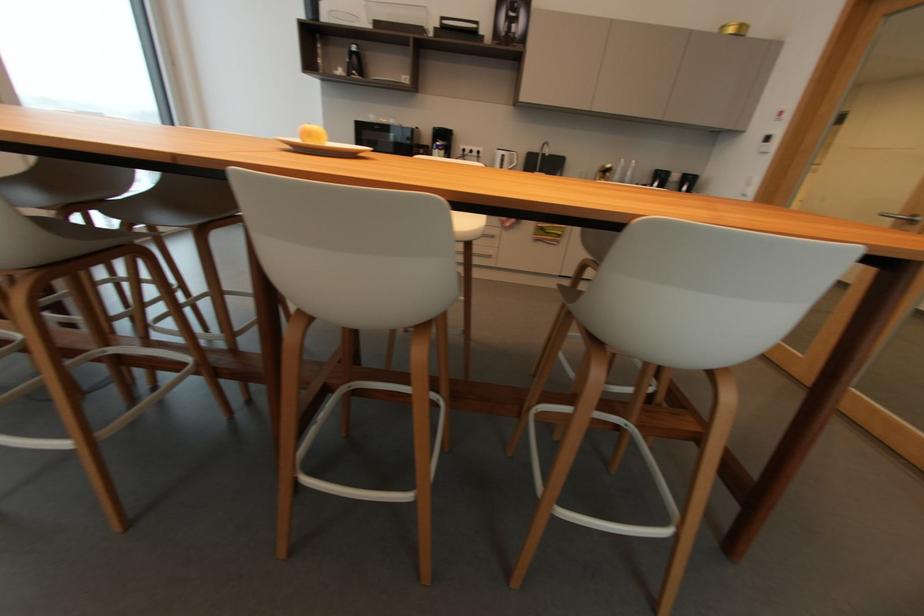
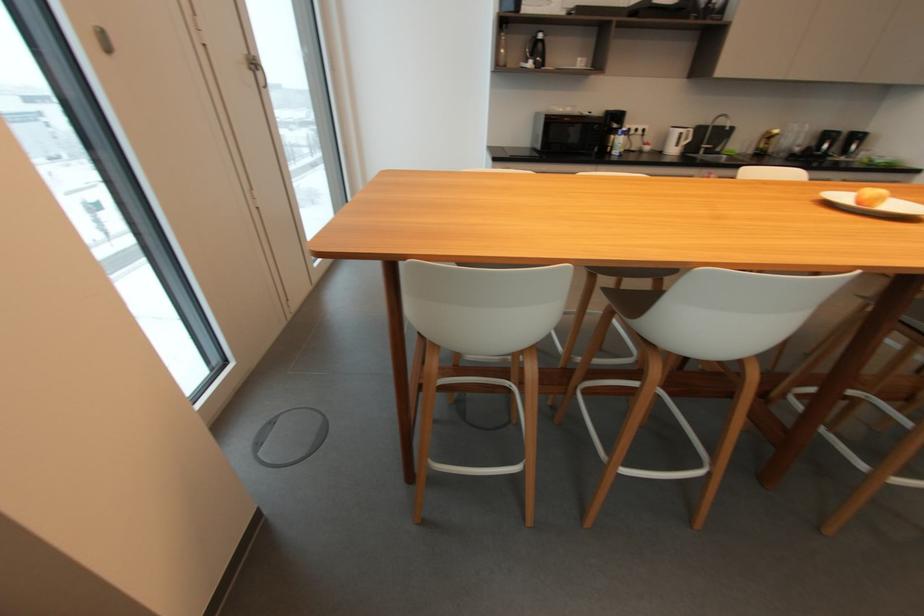
Find the pixel in the second image that matches (505,156) in the first image.

(685, 134)